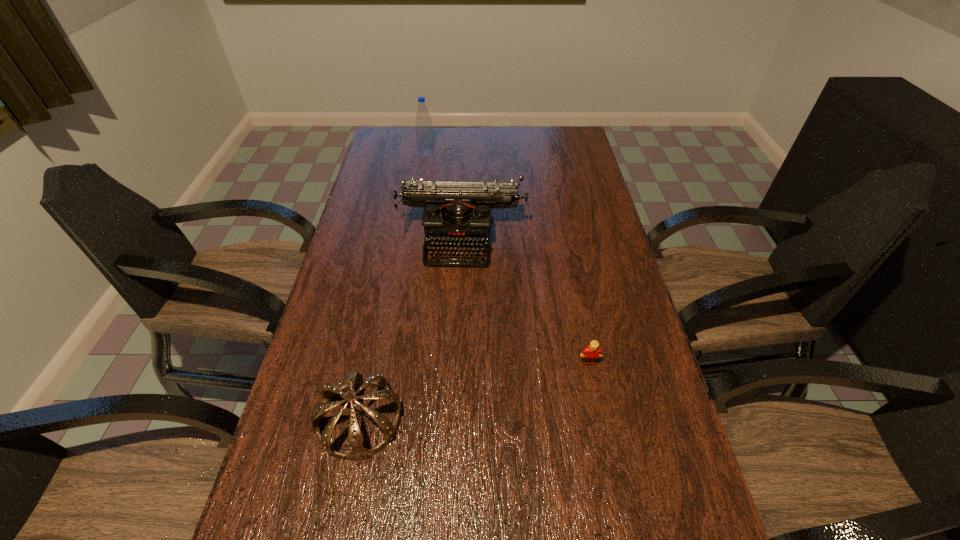
You are a GUI agent. You are given a task and a screenshot of the screen. Output one action in this format:
    pyautogui.click(x=<x>, y=<y>)
    Task: Click on the object that ranks as the closest to the rightmost object
    This screenshot has width=960, height=540.
    Given the screenshot: What is the action you would take?
    pyautogui.click(x=456, y=214)

Choose which object is the second nearest neighbor to the third tallest object. Please provide its 2D coordinates. Your answer should be formatted as a tuple, i.e. [(x, y)], where the tuple contains the x and y coordinates of a point satisfying the conditions above.

[(590, 354)]